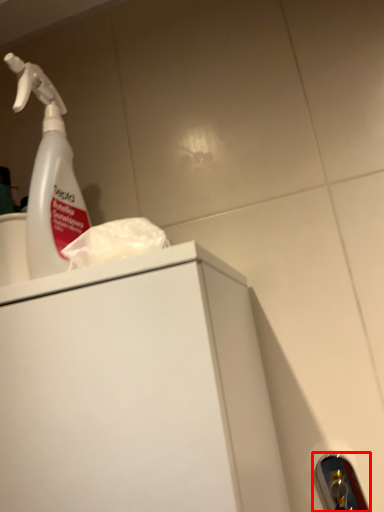
Question: From the image's perspective, what is the correct spatial relationship of door handle (annotated by the red box) in relation to cleaning product?

Choices:
 (A) above
 (B) below

Answer: (B)